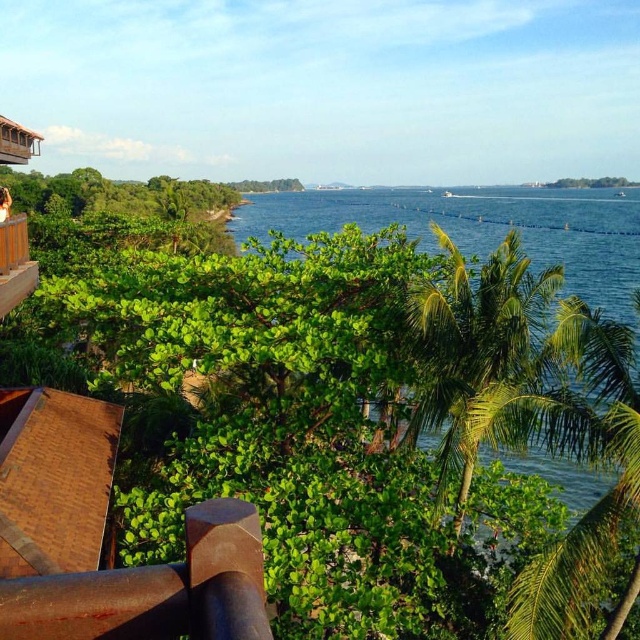
Between point (636, 214) and point (230, 540), which one is positioned behind?

Point (636, 214)

Between green leafy bush at center and rusty metal stilt at lower left, which one has less height?

rusty metal stilt at lower left is shorter.

This screenshot has width=640, height=640. Describe the element at coordinates (486, 227) in the screenshot. I see `green leafy bush at center` at that location.

You are a GUI agent. You are given a task and a screenshot of the screen. Output one action in this format:
    pyautogui.click(x=<x>, y=<y>)
    Task: Click on the green leafy bush at center
    Image resolution: width=640 pixels, height=640 pixels.
    Given the screenshot: What is the action you would take?
    pyautogui.click(x=486, y=227)

Is green leafy bush at center wider than wooden balcony at upper left?

Correct, the width of green leafy bush at center exceeds that of wooden balcony at upper left.

Can you confirm if green leafy bush at center is positioned below wooden balcony at upper left?

Actually, green leafy bush at center is above wooden balcony at upper left.

Does point (467, 189) come behind point (19, 163)?

Yes, point (467, 189) is farther from viewer.

Find the location of a particular element. green leafy bush at center is located at coordinates (486, 227).

Between green leafy bush at center and green leafy palm tree at center, which one has more height?

Standing taller between the two is green leafy bush at center.

Is point (557, 195) in front of point (445, 436)?

No, (557, 195) is behind (445, 436).

I want to click on green leafy bush at center, so click(x=486, y=227).

You are a GUI agent. You are given a task and a screenshot of the screen. Output one action in this format:
    pyautogui.click(x=<x>, y=<y>)
    Task: Click on the green leafy bush at center
    This screenshot has width=640, height=640.
    Given the screenshot: What is the action you would take?
    (486, 227)